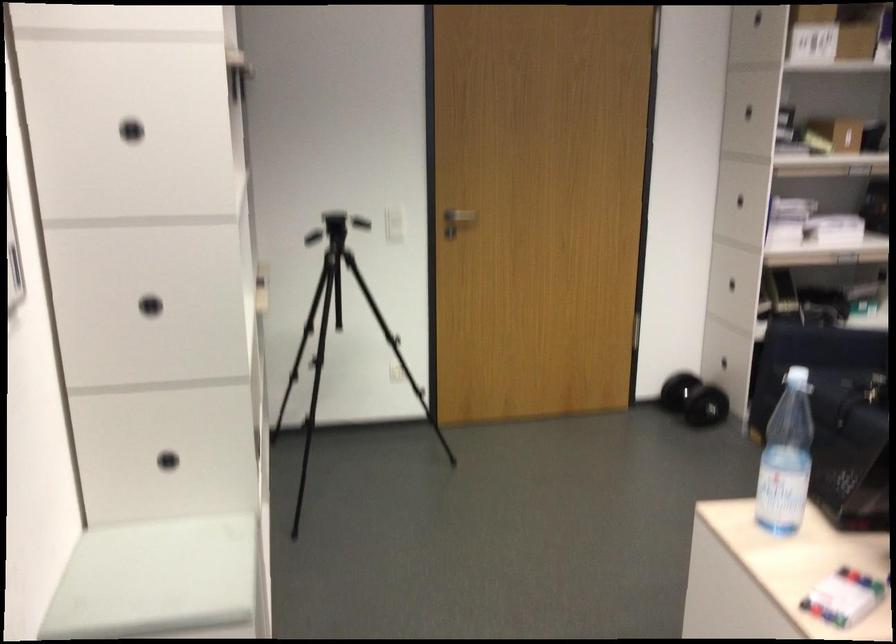
Where would you turn the silver door handle? Please return your answer as a coordinate pair (x, y).

(460, 216)